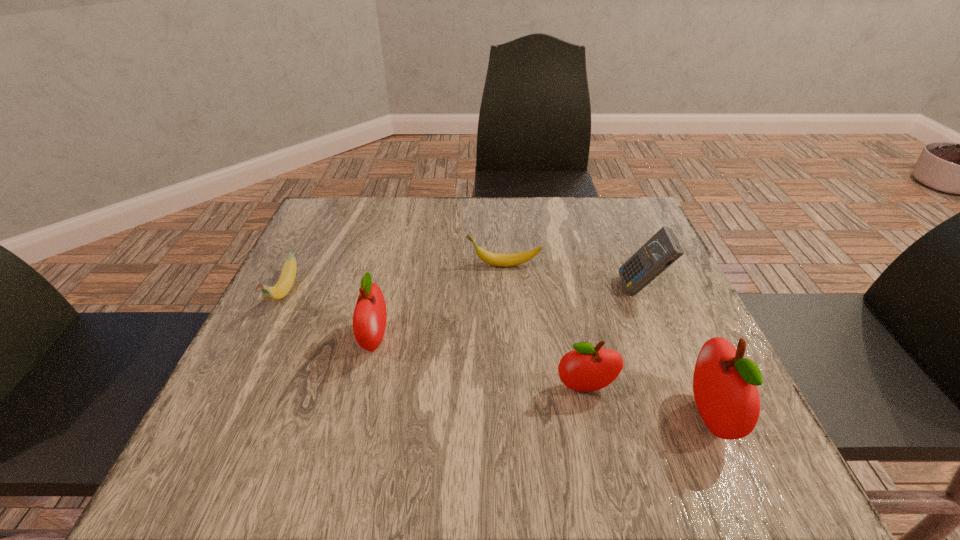
Find the location of a particular element. vacant space located 0.120m on the left of the rightmost apple is located at coordinates (618, 416).

At what (x,y) coordinates should I click in order to perform the action: click on vacant space located on the front-facing side of the calculator. Please return your answer as a coordinate pair (x, y). Looking at the image, I should click on (548, 288).

The image size is (960, 540). I want to click on free space located on the front-facing side of the calculator, so click(503, 288).

Locate an element on the screen. Image resolution: width=960 pixels, height=540 pixels. vacant region located on the front-facing side of the calculator is located at coordinates (486, 288).

The width and height of the screenshot is (960, 540). I want to click on blank area located at the stem of the left banana, so click(x=240, y=383).

This screenshot has width=960, height=540. In order to click on free space located 0.230m at the stem of the right banana in this screenshot , I will do pyautogui.click(x=369, y=265).

I want to click on vacant space located 0.060m at the stem of the right banana, so tap(441, 265).

The height and width of the screenshot is (540, 960). Identify the location of free point located 0.320m at the stem of the right banana. (331, 265).

Where is `object that is at the left edge`? object that is at the left edge is located at coordinates (283, 286).

The width and height of the screenshot is (960, 540). Identify the location of apple located in the right edge section of the desktop. (725, 384).